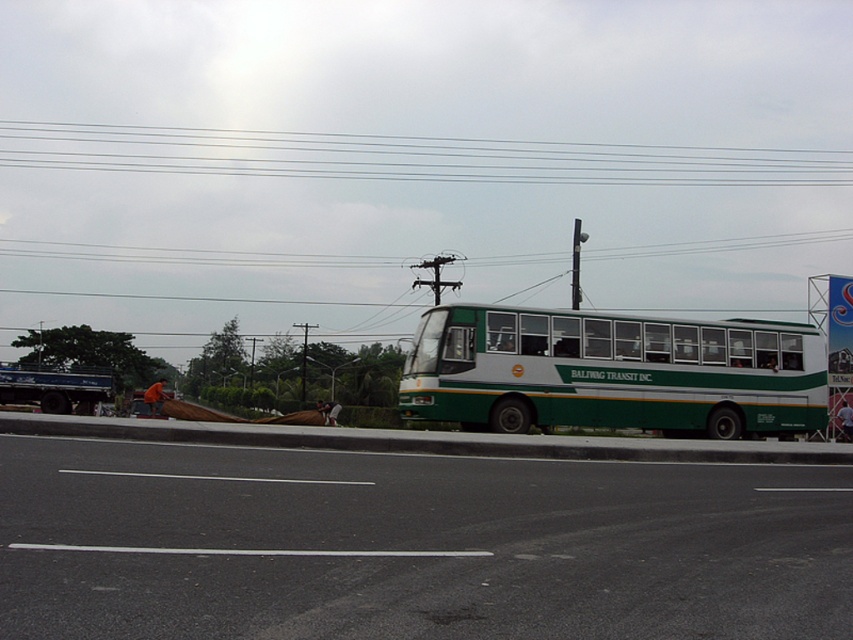
Question: Does green matte bus at center have a smaller size compared to green painted metal bus stop at center right?

Choices:
 (A) no
 (B) yes

Answer: (B)

Question: Can you confirm if green matte bus at center is bigger than clear plastic power lines at upper center?

Choices:
 (A) no
 (B) yes

Answer: (A)

Question: Among these points, which one is farthest from the camera?

Choices:
 (A) (840, 326)
 (B) (584, 182)
 (C) (447, 404)

Answer: (B)

Question: Among these points, which one is farthest from the camera?

Choices:
 (A) (581, 179)
 (B) (815, 276)

Answer: (B)

Question: Does green matte bus at center appear under green painted metal bus stop at center right?

Choices:
 (A) yes
 (B) no

Answer: (A)

Question: Estimate the real-world distances between objects in this image. Which object is closer to the green painted metal bus stop at center right?

Choices:
 (A) clear plastic power lines at upper center
 (B) green matte bus at center

Answer: (B)